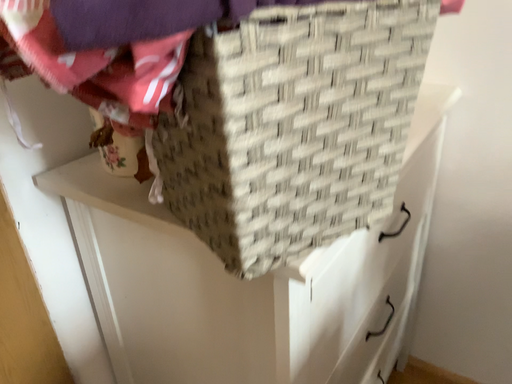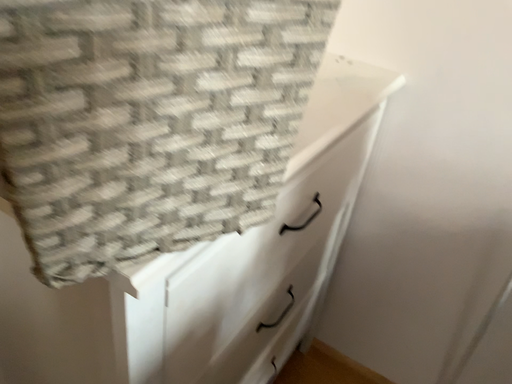
Question: How did the camera likely rotate when shooting the video?

Choices:
 (A) rotated downward
 (B) rotated upward

Answer: (A)